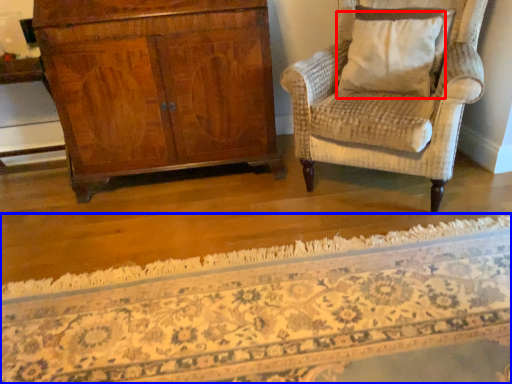
Question: Which object is further to the camera taking this photo, pillow (highlighted by a red box) or mat (highlighted by a blue box)?

Choices:
 (A) pillow
 (B) mat

Answer: (A)